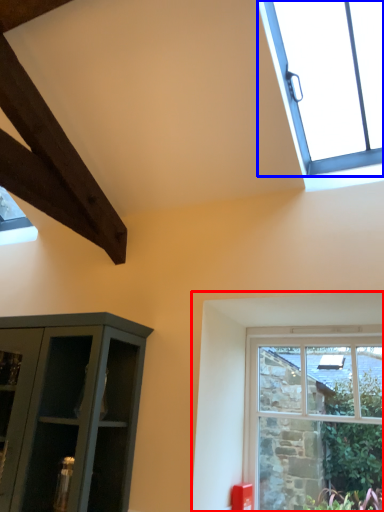
Question: Which point is closer to the camera, window (highlighted by a red box) or window (highlighted by a blue box)?

Choices:
 (A) window
 (B) window

Answer: (B)